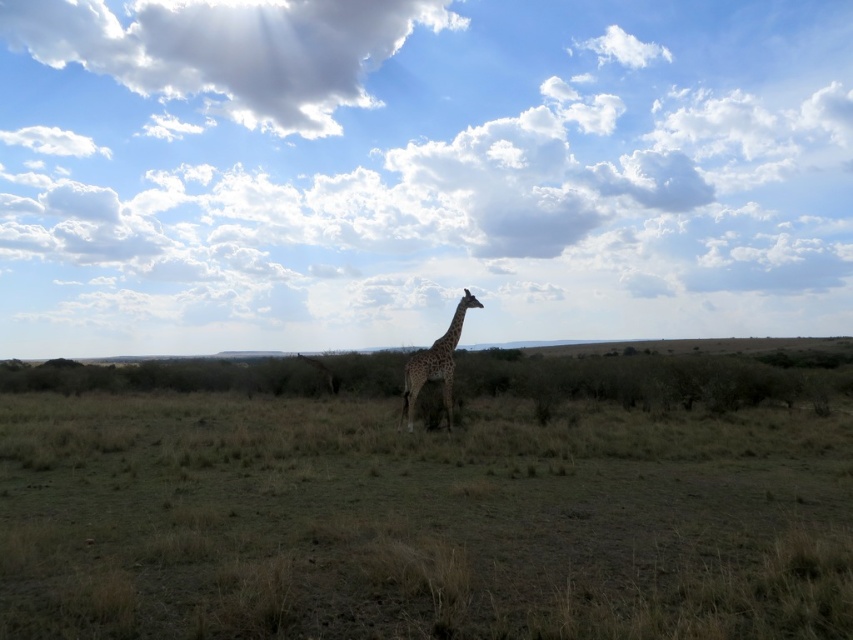
Who is more distant from viewer, (851,77) or (432,374)?

The point (851,77) is more distant.

Can you confirm if cloudy sky at upper center is thinner than giraffe at center?

No.

Between point (465, 193) and point (467, 304), which one is positioned in front?

Point (467, 304) is in front.

Locate an element on the screen. cloudy sky at upper center is located at coordinates (419, 172).

Is cloudy sky at upper center bigger than white fluffy cloud at upper left?

Yes.

How distant is cloudy sky at upper center from white fluffy cloud at upper left?

cloudy sky at upper center is 14.96 meters from white fluffy cloud at upper left.

Locate an element on the screen. cloudy sky at upper center is located at coordinates (419, 172).

Does white fluffy cloud at upper left have a larger size compared to giraffe at center?

Correct, white fluffy cloud at upper left is larger in size than giraffe at center.

Is point (61, 42) in front of point (451, 371)?

No, (61, 42) is behind (451, 371).

Locate an element on the screen. The height and width of the screenshot is (640, 853). white fluffy cloud at upper left is located at coordinates (230, 49).